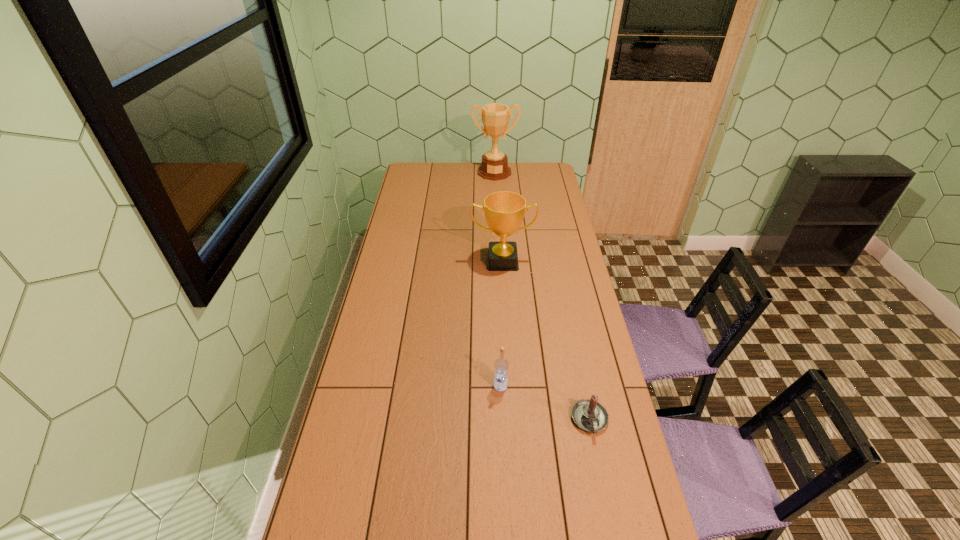
Locate an element on the screen. Image resolution: width=960 pixels, height=540 pixels. free location located 0.260m on the left of the vodka is located at coordinates (418, 386).

Where is `vacant region located 0.080m on the side of the shortest object with the handle loop`? vacant region located 0.080m on the side of the shortest object with the handle loop is located at coordinates (599, 464).

In order to click on object positioned at the far edge in this screenshot , I will do 495,117.

This screenshot has height=540, width=960. In order to click on object present at the right edge in this screenshot , I will do coord(588,414).

The width and height of the screenshot is (960, 540). I want to click on vacant space at the far edge of the desktop, so click(469, 165).

You are a GUI agent. You are given a task and a screenshot of the screen. Output one action in this format:
    pyautogui.click(x=<x>, y=<y>)
    Task: Click on the free space at the left edge
    
    Given the screenshot: What is the action you would take?
    pyautogui.click(x=405, y=195)

This screenshot has width=960, height=540. In order to click on vacant space at the right edge in this screenshot , I will do `click(556, 185)`.

Identify the location of vacant area at the far right corner of the desktop. (557, 179).

At what (x,y) coordinates should I click in order to perform the action: click on free space between the shorter award and the candle. Please return your answer as a coordinate pair (x, y). This screenshot has height=540, width=960. Looking at the image, I should click on (546, 341).

You are a GUI agent. You are given a task and a screenshot of the screen. Output one action in this format:
    pyautogui.click(x=<x>, y=<y>)
    Task: Click on the vacant space in between the shorter award and the second shortest object
    
    Given the screenshot: What is the action you would take?
    pyautogui.click(x=501, y=323)